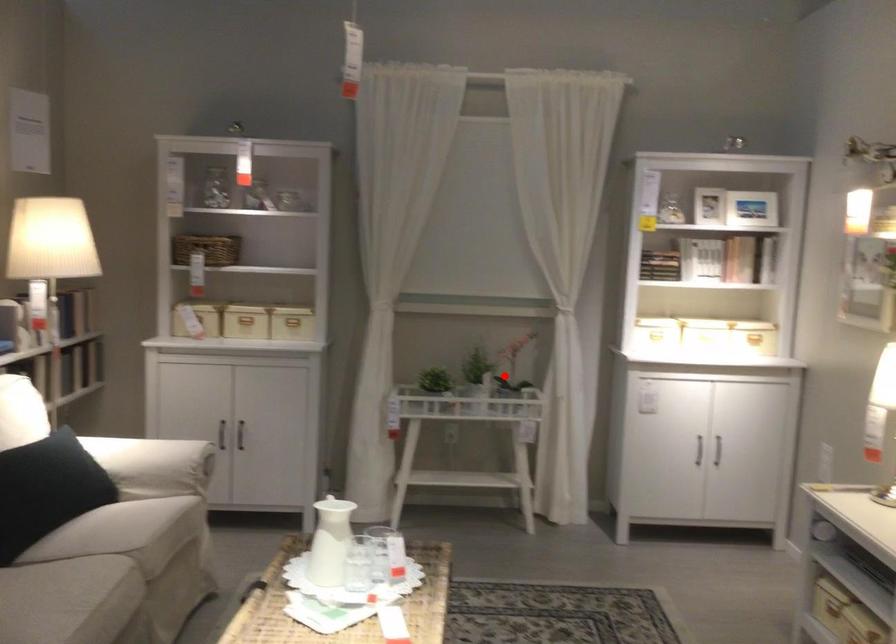
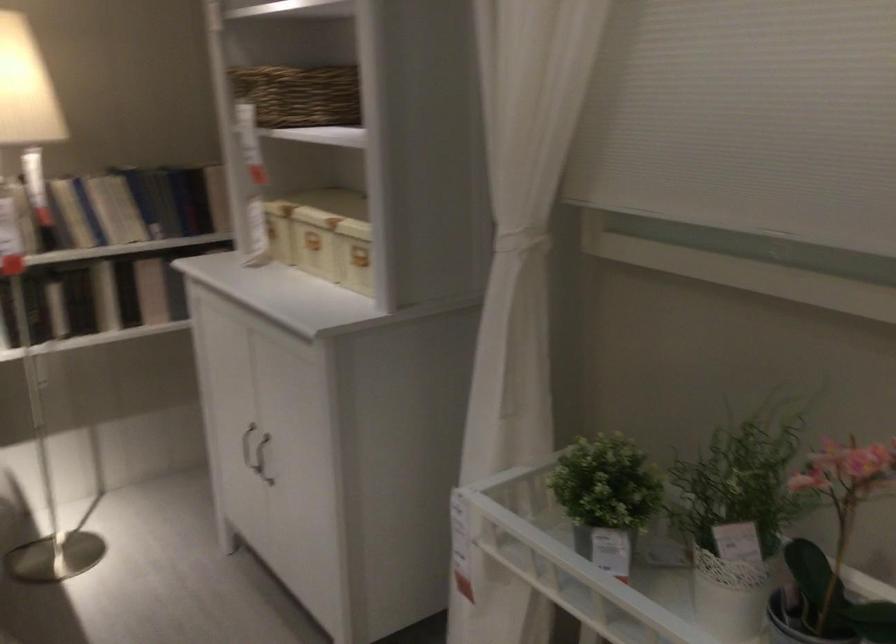
Find the pixel in the second image that matches the highlighted location in the first image.

(735, 518)